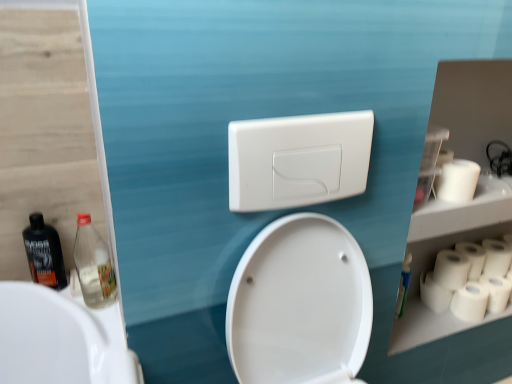
Question: Is white matte toilet paper at right, the 5th toilet paper when ordered from top to bottom, wider than white matte paper towel at right?

Choices:
 (A) no
 (B) yes

Answer: (A)

Question: Is white matte toilet paper at right, the second toilet paper when ordered from bottom to top, turned away from white matte paper towel at right?

Choices:
 (A) yes
 (B) no

Answer: (B)

Question: Is white matte toilet paper at right, the second toilet paper when ordered from bottom to top, to the right of white matte paper towel at right from the viewer's perspective?

Choices:
 (A) no
 (B) yes

Answer: (B)

Question: Is white matte toilet paper at right, the second toilet paper when ordered from bottom to top, positioned in front of white matte paper towel at right?

Choices:
 (A) no
 (B) yes

Answer: (A)

Question: Could you tell me if white matte toilet paper at right, the second toilet paper when ordered from bottom to top, is turned towards white matte paper towel at right?

Choices:
 (A) yes
 (B) no

Answer: (B)

Question: From the image's perspective, is white matte toilet paper at right, the second toilet paper when ordered from bottom to top, above white matte paper towel at right?

Choices:
 (A) no
 (B) yes

Answer: (A)

Question: Is white matte paper towel at right facing away from matte black bottle at left, which is counted as the first bottle, starting from the left?

Choices:
 (A) yes
 (B) no

Answer: (B)

Question: Does white matte paper towel at right come behind matte black bottle at left, which is counted as the first bottle, starting from the left?

Choices:
 (A) no
 (B) yes

Answer: (B)

Question: Can you confirm if white matte paper towel at right is positioned to the right of matte black bottle at left, arranged as the second bottle when viewed from the right?

Choices:
 (A) no
 (B) yes

Answer: (B)

Question: From the image's perspective, would you say white matte paper towel at right is positioned over matte black bottle at left, arranged as the second bottle when viewed from the right?

Choices:
 (A) yes
 (B) no

Answer: (B)

Question: Does white matte paper towel at right have a lesser width compared to matte black bottle at left, arranged as the second bottle when viewed from the right?

Choices:
 (A) yes
 (B) no

Answer: (B)

Question: Considering the relative sizes of white matte paper towel at right and matte black bottle at left, arranged as the second bottle when viewed from the right, in the image provided, is white matte paper towel at right shorter than matte black bottle at left, arranged as the second bottle when viewed from the right,?

Choices:
 (A) no
 (B) yes

Answer: (B)

Question: Is white matte toilet paper at right, the second toilet paper when ordered from bottom to top, completely or partially outside of white plastic switch at upper center?

Choices:
 (A) yes
 (B) no

Answer: (A)